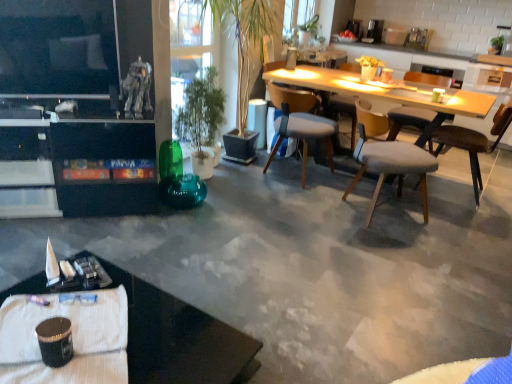
The width and height of the screenshot is (512, 384). I want to click on vacant region to the left of matte white mug at upper center, marked as the second coffee cup in a left-to-right arrangement, so click(367, 82).